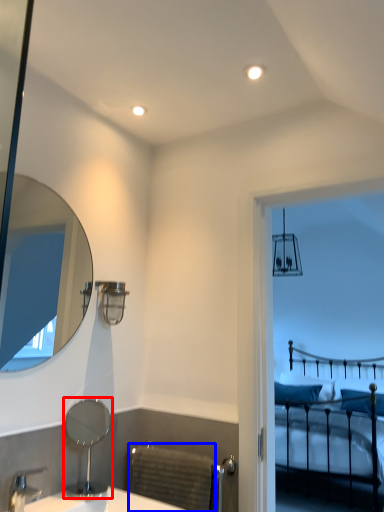
Question: Which of the following is the closest to the observer, mirror (highlighted by a red box) or radiator (highlighted by a blue box)?

Choices:
 (A) mirror
 (B) radiator

Answer: (A)